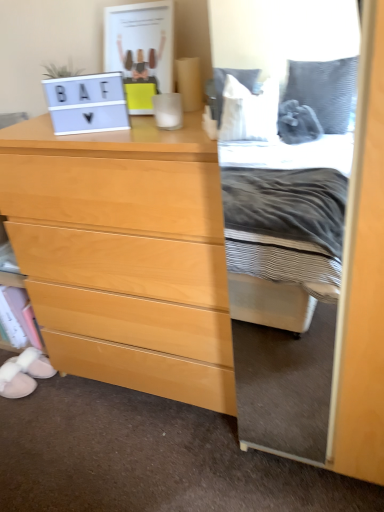
The width and height of the screenshot is (384, 512). I want to click on vacant area that lies to the right of white suede slipper at lower left, which is the second shoe from back to front, so click(x=50, y=397).